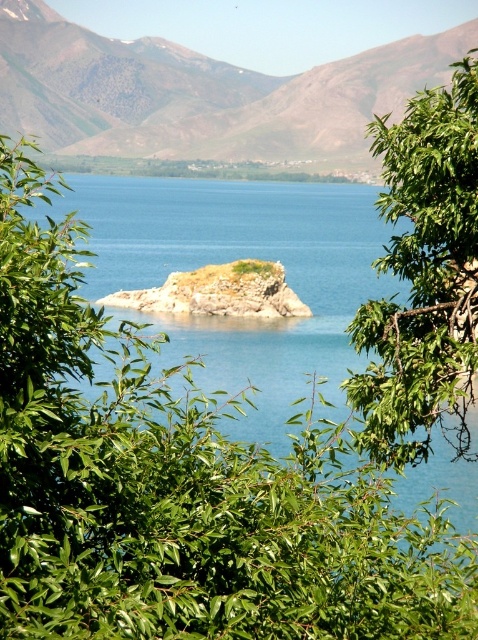
Question: Which point is farther to the camera?

Choices:
 (A) (349, 234)
 (B) (452, 116)
 (C) (209, 305)
 (D) (10, 74)

Answer: (D)

Question: Among these points, which one is nearest to the camera?

Choices:
 (A) (476, 72)
 (B) (35, 129)
 (C) (129, 186)
 (D) (228, 301)

Answer: (A)

Question: Is blue smooth water at center to the left of green leafy branch at upper right from the viewer's perspective?

Choices:
 (A) no
 (B) yes

Answer: (B)

Question: Among these objects, which one is nearest to the camera?

Choices:
 (A) brown rocky mountain at center
 (B) green leafy branch at upper right
 (C) brown rocky island at center

Answer: (B)

Question: Is blue smooth water at center closer to camera compared to brown rocky island at center?

Choices:
 (A) yes
 (B) no

Answer: (A)

Question: Does brown rocky mountain at center appear over brown rocky island at center?

Choices:
 (A) no
 (B) yes

Answer: (B)